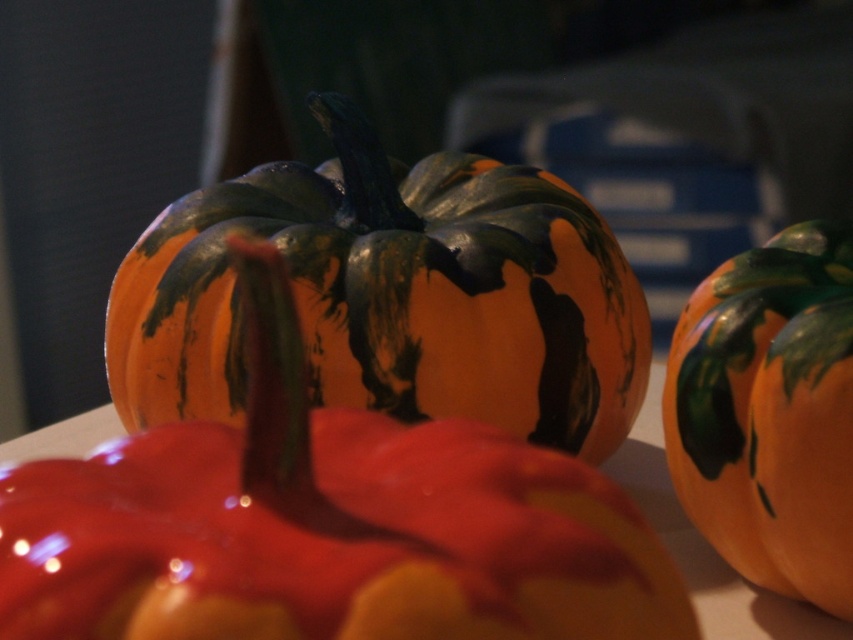
You are arranging pumpkins on a shelf and need to know their positions. Which pumpkin is directly above the other between the orange matte pumpkin at center and the orange matte pumpkin at right?

The orange matte pumpkin at right is directly above the orange matte pumpkin at center because the orange matte pumpkin at center is positioned under the orange matte pumpkin at right.

You are arranging pumpkins on a shelf. You have two pumpkins labeled as orange matte pumpkin at center and matte orange pumpkin at center. Which one should you place lower on the shelf if you want the taller pumpkin to be more visible?

You should place the orange matte pumpkin at center lower on the shelf because the matte orange pumpkin at center is taller, allowing it to be more visible when placed higher.